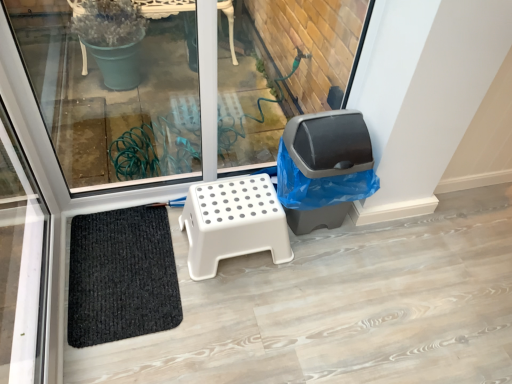
Where is `blank area beneath black woven mat at lower left (from a real-world perspective)`? The width and height of the screenshot is (512, 384). blank area beneath black woven mat at lower left (from a real-world perspective) is located at coordinates (123, 262).